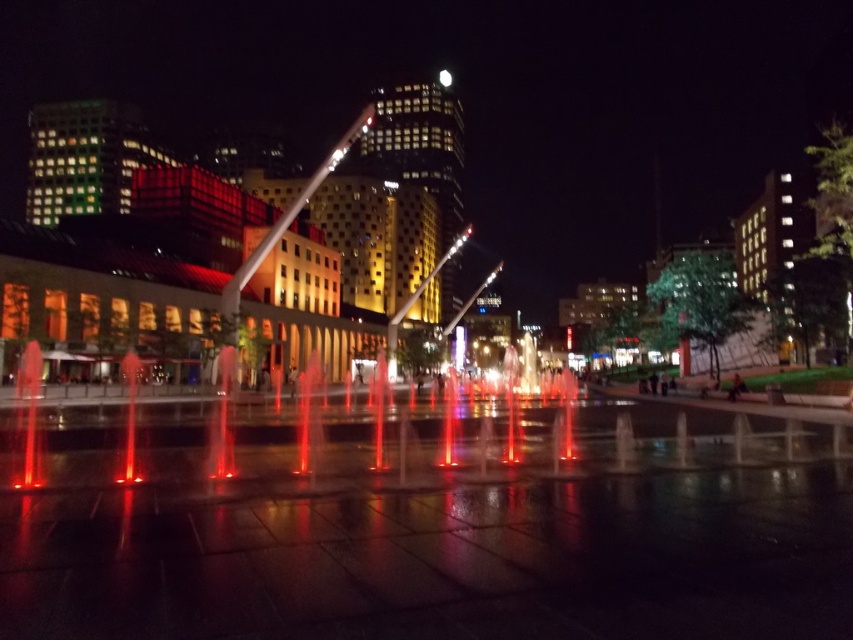
Is point (341, 429) positioned after point (309, 193)?

No, it is not.

Describe the element at coordinates (387, 435) in the screenshot. I see `translucent glass water jets at center` at that location.

Locate an element on the screen. The width and height of the screenshot is (853, 640). translucent glass water jets at center is located at coordinates (387, 435).